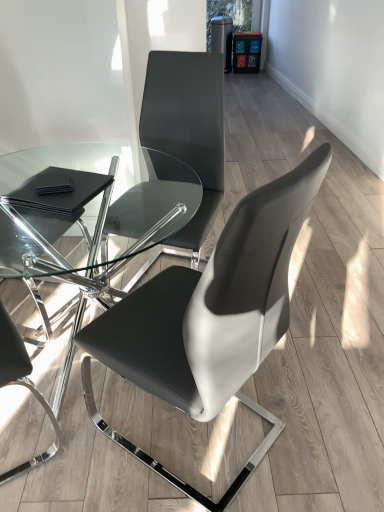
Question: Is black leather chair at left, arranged as the 3th chair when viewed from the right, wider than transparent glass table at center?

Choices:
 (A) no
 (B) yes

Answer: (A)

Question: Does black leather chair at left, which is the first chair from left to right, come in front of transparent glass table at center?

Choices:
 (A) yes
 (B) no

Answer: (B)

Question: From a real-world perspective, does black leather chair at left, which is the first chair from left to right, sit lower than transparent glass table at center?

Choices:
 (A) no
 (B) yes

Answer: (A)

Question: Are black leather chair at left, arranged as the 3th chair when viewed from the right, and transparent glass table at center located far from each other?

Choices:
 (A) no
 (B) yes

Answer: (A)

Question: Does black leather chair at left, which is the first chair from left to right, appear on the left side of transparent glass table at center?

Choices:
 (A) yes
 (B) no

Answer: (A)

Question: Is transparent glass table at center at the back of black leather chair at left, which is the first chair from left to right?

Choices:
 (A) yes
 (B) no

Answer: (A)

Question: Is matte black chair at center, marked as the 2th chair in a right-to-left arrangement, at the right side of black leather chair at left, arranged as the 3th chair when viewed from the right?

Choices:
 (A) no
 (B) yes

Answer: (B)

Question: Is matte black chair at center, which is the 2th chair in left-to-right order, next to black leather chair at left, which is the first chair from left to right?

Choices:
 (A) no
 (B) yes

Answer: (A)

Question: From the image's perspective, does matte black chair at center, marked as the 2th chair in a right-to-left arrangement, appear higher than black leather chair at left, arranged as the 3th chair when viewed from the right?

Choices:
 (A) no
 (B) yes

Answer: (B)

Question: Would you say matte black chair at center, which is the 2th chair in left-to-right order, is outside black leather chair at left, arranged as the 3th chair when viewed from the right?

Choices:
 (A) yes
 (B) no

Answer: (A)

Question: From a real-world perspective, is matte black chair at center, which is the 2th chair in left-to-right order, positioned over black leather chair at left, arranged as the 3th chair when viewed from the right, based on gravity?

Choices:
 (A) no
 (B) yes

Answer: (A)

Question: Is matte black chair at center, marked as the 2th chair in a right-to-left arrangement, smaller than black leather chair at left, arranged as the 3th chair when viewed from the right?

Choices:
 (A) no
 (B) yes

Answer: (A)

Question: Does black leather chair at left, arranged as the 3th chair when viewed from the right, have a lesser width compared to black leather pads at lower left?

Choices:
 (A) no
 (B) yes

Answer: (A)